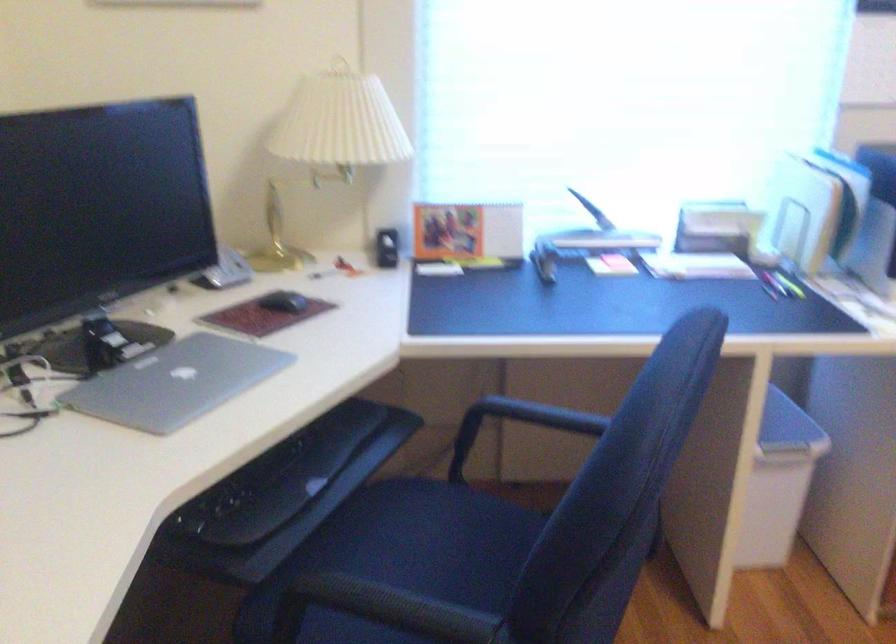
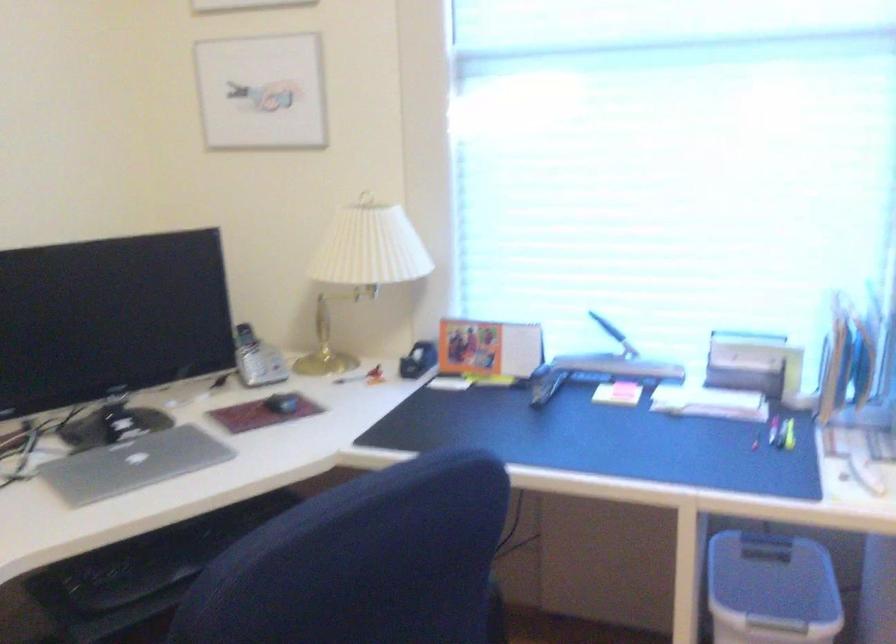
Where in the second image is the point corresponding to pixel 386 249 from the first image?

(418, 360)